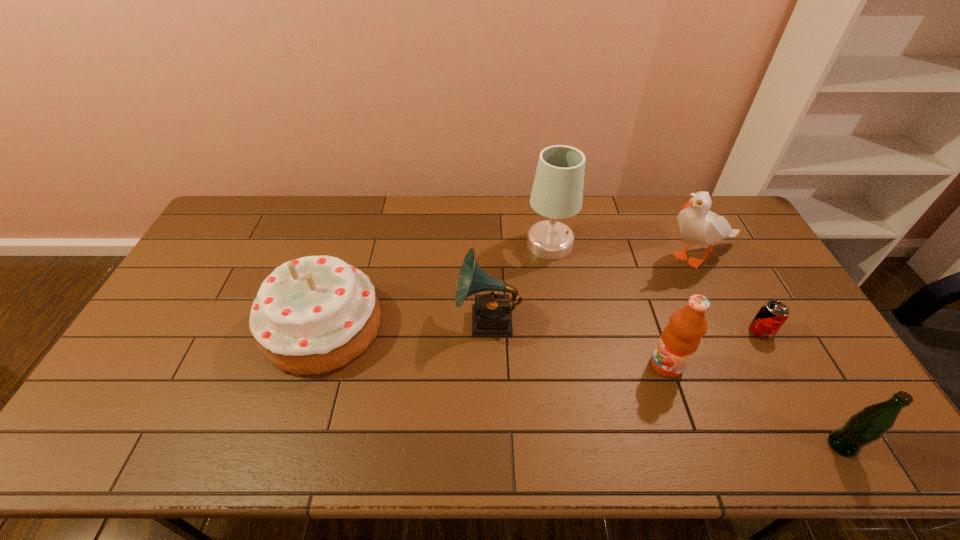
Where is `free point between the lampshade and the shortest object`? free point between the lampshade and the shortest object is located at coordinates (656, 288).

Image resolution: width=960 pixels, height=540 pixels. Find the location of `vacant area that lies between the phonograph_record and the leftmost object`. vacant area that lies between the phonograph_record and the leftmost object is located at coordinates (405, 323).

Where is `empty location between the lampshade and the shortest object`? The width and height of the screenshot is (960, 540). empty location between the lampshade and the shortest object is located at coordinates (656, 288).

What are the coordinates of `vacant region between the beer bottle and the soda can` in the screenshot? It's located at (802, 388).

Where is `vacant space in between the cake and the fruit juice`? The width and height of the screenshot is (960, 540). vacant space in between the cake and the fruit juice is located at coordinates (494, 346).

Find the location of `vacant space in between the shortest object and the phonograph_record`. vacant space in between the shortest object and the phonograph_record is located at coordinates (625, 326).

Locate an element on the screen. Image resolution: width=960 pixels, height=540 pixels. free space between the leftmost object and the soda can is located at coordinates (541, 329).

I want to click on free area in between the beer bottle and the phonograph_record, so click(665, 383).

Image resolution: width=960 pixels, height=540 pixels. I want to click on free spot between the third object from left to right and the soda can, so click(x=656, y=288).

Find the location of a particular element. This screenshot has width=960, height=540. vacant point located between the gull and the second object from left to right is located at coordinates (592, 289).